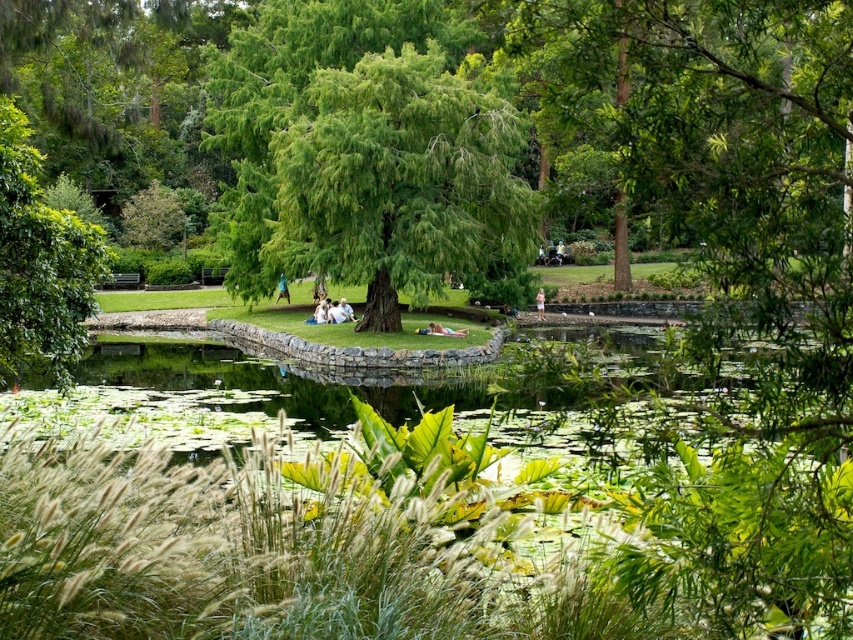
You are planning to sit on the light brown wooden bench at center while the blue fabric person at center is standing nearby. Based on their heights, will the bench provide a comfortable seating height for you?

The light brown wooden bench at center is not as tall as the blue fabric person at center, so it should provide a comfortable seating height since it is appropriately proportioned for someone of that height.

In the scene shown: In the park scene with a pond and a stone pathway, there is a blue fabric person at center and a pink fabric dress at center. From the perspective of an observer standing at the edge of the pond, which object is positioned higher up in the image?

The blue fabric person at center is located above the pink fabric dress at center, so the blue fabric person at center is positioned higher up in the image.

You are standing at the edge of the pond in the park scene. You want to sit down on the light brown wooden bench at center. However, there is a blue fabric person at center in your way. Based on their positions, can you walk directly to the bench without moving around the person?

The light brown wooden bench at center is located below the blue fabric person at center, meaning the person is positioned above the bench from your viewpoint. Since the bench is below the person, you can walk directly to the bench without needing to go around them as they are not blocking your path.